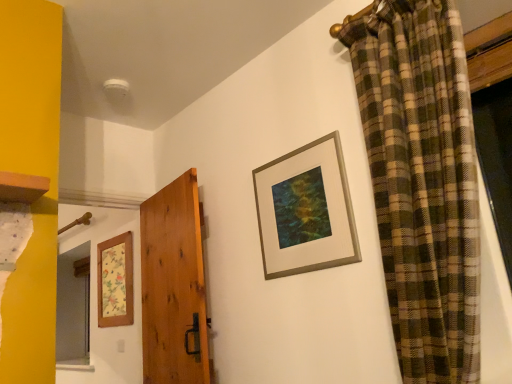
Question: From the image's perspective, relative to wooden floral-patterned picture frame at left, the 1th picture frame positioned from the bottom, is gold metallic picture frame at upper center, which is the 1th picture frame from top to bottom, above or below?

Choices:
 (A) below
 (B) above

Answer: (B)

Question: From a real-world perspective, is gold metallic picture frame at upper center, acting as the first picture frame starting from the front, physically located above or below wooden floral-patterned picture frame at left, which is the second picture frame in right-to-left order?

Choices:
 (A) below
 (B) above

Answer: (B)

Question: Which object is positioned farthest from the natural wood door at center?

Choices:
 (A) wooden floral-patterned picture frame at left, which is the second picture frame in right-to-left order
 (B) gold metallic picture frame at upper center, the 2th picture frame from the left

Answer: (B)

Question: Which object is the closest to the natural wood door at center?

Choices:
 (A) gold metallic picture frame at upper center, acting as the first picture frame starting from the front
 (B) wooden floral-patterned picture frame at left, the second picture frame in the front-to-back sequence

Answer: (B)